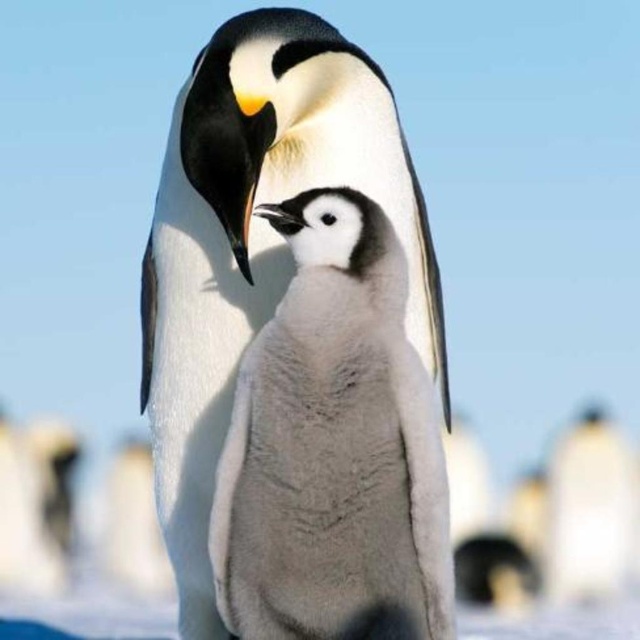
Question: From the image, what is the correct spatial relationship of white fluffy penguin at center in relation to white fluffy penguin at lower right?

Choices:
 (A) right
 (B) left

Answer: (B)

Question: Which point is closer to the camera taking this photo?

Choices:
 (A) (349, 160)
 (B) (589, 566)

Answer: (A)

Question: Does white fluffy penguin at center appear on the right side of white fluffy penguin at lower right?

Choices:
 (A) no
 (B) yes

Answer: (A)

Question: Which of the following is the farthest from the observer?

Choices:
 (A) white fluffy penguin at center
 (B) white fluffy penguin at lower right

Answer: (B)

Question: Is white fluffy penguin at center positioned before white fluffy penguin at lower right?

Choices:
 (A) yes
 (B) no

Answer: (A)